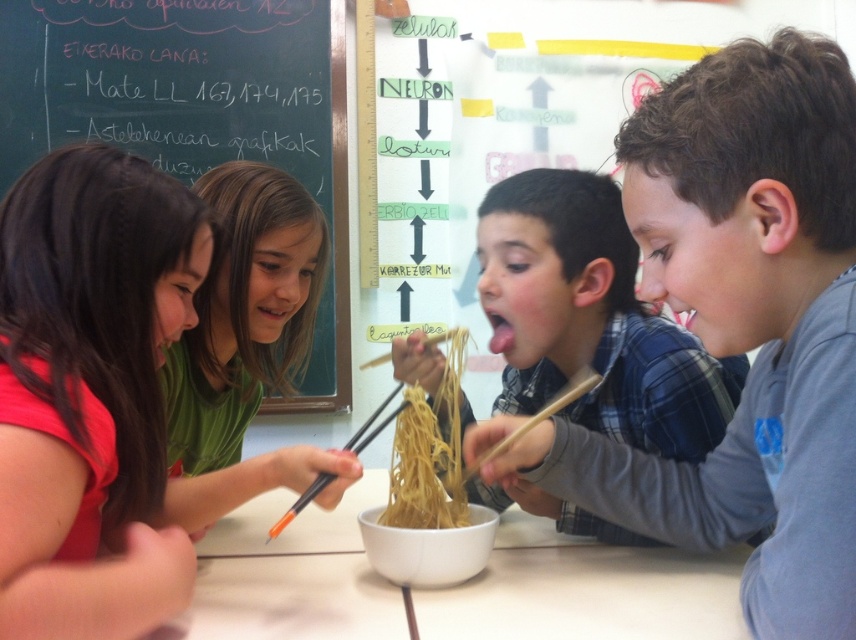
Between point (527, 592) and point (444, 458), which one is positioned behind?

The point (444, 458) is behind.

Between point (449, 596) and point (440, 474), which one is positioned in front?

Positioned in front is point (449, 596).

Locate an element on the screen. white matte table at center is located at coordinates (586, 589).

Which of these two, smooth gray shirt at right or white matte table at center, stands taller?

With more height is smooth gray shirt at right.

Is point (488, 429) positioned after point (497, 541)?

No, it is not.

I want to click on smooth gray shirt at right, so click(x=742, y=326).

The width and height of the screenshot is (856, 640). What do you see at coordinates (426, 465) in the screenshot? I see `yellow matte noodles at center` at bounding box center [426, 465].

Measure the distance between yellow matte noodles at center and camera.

The distance of yellow matte noodles at center from camera is 36.10 inches.

Does point (440, 464) lie behind point (557, 403)?

Yes, it is behind point (557, 403).

The width and height of the screenshot is (856, 640). Find the location of `yellow matte noodles at center`. yellow matte noodles at center is located at coordinates (426, 465).